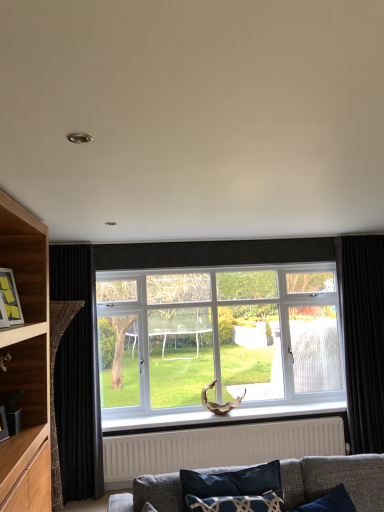
This screenshot has width=384, height=512. What are the coordinates of `velvet dark blue pillow at lower center` in the screenshot? It's located at (232, 489).

Locate an element on the screen. black velvet curtain at right, placed as the 1th curtain when sorted from right to left is located at coordinates (363, 338).

What do you see at coordinates (219, 330) in the screenshot? I see `white plastic window at center` at bounding box center [219, 330].

The width and height of the screenshot is (384, 512). What are the coordinates of `wooden frame at left` in the screenshot? It's located at (10, 297).

The height and width of the screenshot is (512, 384). I want to click on velvet dark blue pillow at lower center, so click(232, 489).

Does white plastic window at center have a smaller size compared to white textured radiator at lower center?

No.

From their relative heights in the image, would you say white plastic window at center is taller or shorter than white textured radiator at lower center?

In the image, white plastic window at center appears to be taller than white textured radiator at lower center.

How much distance is there between white plastic window at center and white textured radiator at lower center?

white plastic window at center and white textured radiator at lower center are 75.21 centimeters apart from each other.

The width and height of the screenshot is (384, 512). I want to click on radiator below the white plastic window at center (from the image's perspective), so click(218, 447).

Can you confirm if black velvet curtain at left, acting as the 1th curtain starting from the left, is smaller than white plastic window at center?

Correct, black velvet curtain at left, acting as the 1th curtain starting from the left, occupies less space than white plastic window at center.

How different are the orientations of black velvet curtain at left, acting as the 1th curtain starting from the left, and white plastic window at center in degrees?

0.0586 degrees.

Is the surface of black velvet curtain at left, acting as the 1th curtain starting from the left, in direct contact with white plastic window at center?

black velvet curtain at left, acting as the 1th curtain starting from the left, is not next to white plastic window at center, and they're not touching.

Can you confirm if black velvet curtain at left, acting as the 1th curtain starting from the left, is wider than white plastic window at center?

No.

Is black velvet curtain at right, which ranks as the second curtain in left-to-right order, far away from white plastic window at center?

No, black velvet curtain at right, which ranks as the second curtain in left-to-right order, is in close proximity to white plastic window at center.

Is black velvet curtain at right, which ranks as the second curtain in left-to-right order, taller than white plastic window at center?

Indeed, black velvet curtain at right, which ranks as the second curtain in left-to-right order, has a greater height compared to white plastic window at center.

Where is `the 1st curtain directly beneath the white plastic window at center (from a real-world perspective)`? The height and width of the screenshot is (512, 384). the 1st curtain directly beneath the white plastic window at center (from a real-world perspective) is located at coordinates (363, 338).

From the image's perspective, which is below, black velvet curtain at left, which is the 2th curtain in right-to-left order, or velvet dark blue pillow at lower center?

From the image's view, velvet dark blue pillow at lower center is below.

Which is in front, point (63, 471) or point (233, 477)?

Positioned in front is point (233, 477).

Would you say black velvet curtain at left, which is the 2th curtain in right-to-left order, is to the left or to the right of velvet dark blue pillow at lower center in the picture?

From the image, it's evident that black velvet curtain at left, which is the 2th curtain in right-to-left order, is to the left of velvet dark blue pillow at lower center.

Is black velvet curtain at left, acting as the 1th curtain starting from the left, positioned beyond the bounds of velvet dark blue pillow at lower center?

Yes, black velvet curtain at left, acting as the 1th curtain starting from the left, is outside of velvet dark blue pillow at lower center.

How different are the orientations of wooden frame at left and white plastic window at center in degrees?

The angle between the facing direction of wooden frame at left and the facing direction of white plastic window at center is 69.7 degrees.

Looking at this image, considering the relative sizes of wooden frame at left and white plastic window at center in the image provided, is wooden frame at left wider than white plastic window at center?

In fact, wooden frame at left might be narrower than white plastic window at center.

Which object is closer to the camera, wooden frame at left or white plastic window at center?

wooden frame at left.

Can we say wooden frame at left lies outside white plastic window at center?

Indeed, wooden frame at left is completely outside white plastic window at center.

Is black velvet curtain at right, placed as the 1th curtain when sorted from right to left, at the back of white plastic window at center?

No.

Which object is positioned more to the right, white plastic window at center or black velvet curtain at right, placed as the 1th curtain when sorted from right to left?

From the viewer's perspective, black velvet curtain at right, placed as the 1th curtain when sorted from right to left, appears more on the right side.

Is white plastic window at center with black velvet curtain at right, which ranks as the second curtain in left-to-right order?

No, white plastic window at center is not making contact with black velvet curtain at right, which ranks as the second curtain in left-to-right order.

Is black velvet curtain at right, which ranks as the second curtain in left-to-right order, inside white plastic window at center?

No, black velvet curtain at right, which ranks as the second curtain in left-to-right order, is located outside of white plastic window at center.

Which is more to the left, black velvet curtain at right, placed as the 1th curtain when sorted from right to left, or white textured radiator at lower center?

white textured radiator at lower center is more to the left.

This screenshot has width=384, height=512. I want to click on radiator below the black velvet curtain at right, placed as the 1th curtain when sorted from right to left (from the image's perspective), so click(x=218, y=447).

Is black velvet curtain at right, placed as the 1th curtain when sorted from right to left, positioned behind white textured radiator at lower center?

Yes, it is.

Find the location of a particular element. The height and width of the screenshot is (512, 384). window above the white textured radiator at lower center (from a real-world perspective) is located at coordinates (219, 330).

What are the coordinates of `curtain on the left of white plastic window at center` in the screenshot? It's located at (77, 375).

Based on their spatial positions, is velvet dark blue pillow at lower center or black velvet curtain at right, placed as the 1th curtain when sorted from right to left, further from white plastic window at center?

velvet dark blue pillow at lower center lies further to white plastic window at center than the other object.

From the image, which object appears to be nearer to black velvet curtain at right, which ranks as the second curtain in left-to-right order, black velvet curtain at left, which is the 2th curtain in right-to-left order, or velvet dark blue pillow at lower center?

velvet dark blue pillow at lower center is positioned closer to the anchor black velvet curtain at right, which ranks as the second curtain in left-to-right order.

Estimate the real-world distances between objects in this image. Which object is closer to white textured radiator at lower center, white plastic window at center or wooden frame at left?

white plastic window at center is positioned closer to the anchor white textured radiator at lower center.

From the picture: From the image, which object appears to be farther from velvet dark blue pillow at lower center, white textured radiator at lower center or white plastic window at center?

white plastic window at center is further to velvet dark blue pillow at lower center.

Based on their spatial positions, is white plastic window at center or wooden frame at left closer to black velvet curtain at left, which is the 2th curtain in right-to-left order?

Based on the image, white plastic window at center appears to be nearer to black velvet curtain at left, which is the 2th curtain in right-to-left order.

Which object lies further to the anchor point white plastic window at center, black velvet curtain at left, acting as the 1th curtain starting from the left, or black velvet curtain at right, which ranks as the second curtain in left-to-right order?

black velvet curtain at left, acting as the 1th curtain starting from the left.

From the image, which object appears to be nearer to velvet dark blue pillow at lower center, black velvet curtain at left, acting as the 1th curtain starting from the left, or black velvet curtain at right, placed as the 1th curtain when sorted from right to left?

black velvet curtain at left, acting as the 1th curtain starting from the left, is positioned closer to the anchor velvet dark blue pillow at lower center.

Based on the photo, based on their spatial positions, is velvet dark blue pillow at lower center or wooden frame at left further from black velvet curtain at left, acting as the 1th curtain starting from the left?

velvet dark blue pillow at lower center lies further to black velvet curtain at left, acting as the 1th curtain starting from the left, than the other object.

Find the location of a particular element. curtain between wooden frame at left and white plastic window at center is located at coordinates (77, 375).

Image resolution: width=384 pixels, height=512 pixels. I want to click on curtain situated between wooden frame at left and black velvet curtain at right, placed as the 1th curtain when sorted from right to left, from left to right, so click(x=77, y=375).

The height and width of the screenshot is (512, 384). In order to click on curtain between wooden frame at left and white textured radiator at lower center from left to right in this screenshot , I will do `click(77, 375)`.

Image resolution: width=384 pixels, height=512 pixels. What are the coordinates of `radiator between black velvet curtain at left, which is the 2th curtain in right-to-left order, and black velvet curtain at right, which ranks as the second curtain in left-to-right order, from left to right` in the screenshot? It's located at (218, 447).